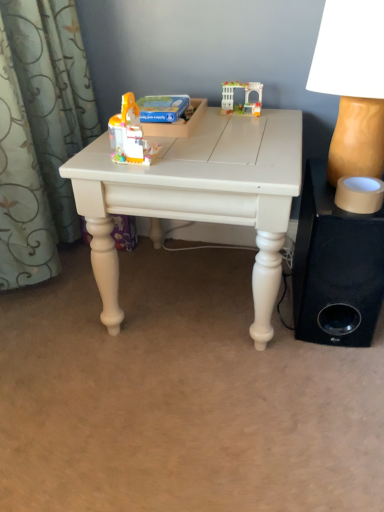
In order to click on free space in front of white matte table at center in this screenshot , I will do `click(195, 414)`.